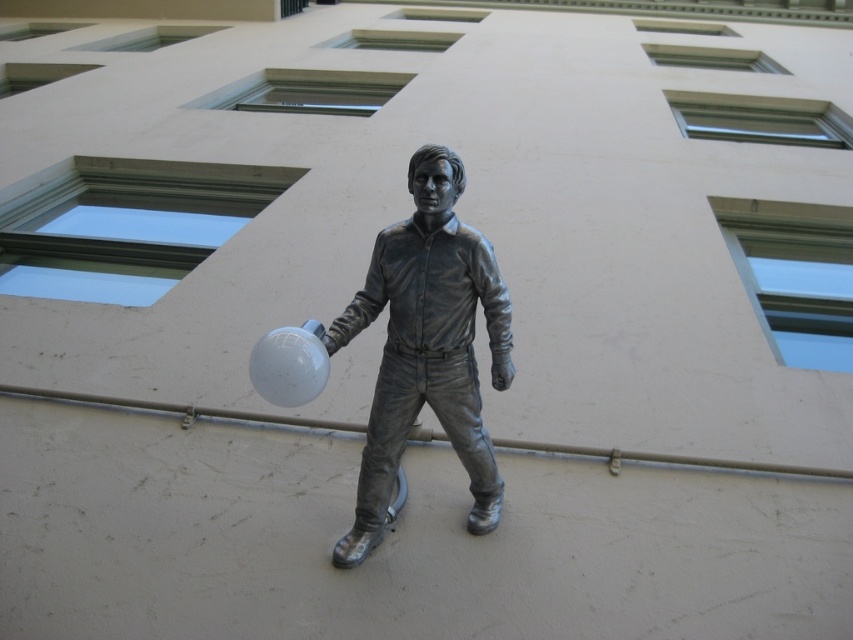
From the picture: You are a photographer trying to capture the shiny bronze figure at center and the white glossy balloon at center in a single shot. Based on their positions, which object should you adjust your camera to focus on first if you want the balloon to be in the foreground?

The shiny bronze figure at center is positioned on the right side of white glossy balloon at center. To have the balloon in the foreground, you should focus on the white glossy balloon at center first since it is closer to the camera.

You are standing in front of the statue and want to reach a point that is exactly 10 feet away from you. Can you reach the point at coordinate point (392, 440)?

The distance of point (392, 440) from viewer is 11.05 feet, which is more than 10 feet, so you cannot reach it.

You are a photographer standing at a distance from the shiny bronze figure at center. You want to take a closeup shot of the statue without moving closer. Your camera has a zoom range of 2 meters. Can you capture the entire statue in your photo?

The shiny bronze figure at center is 2.95 meters from viewer. Since the camera can zoom up to 2 meters, it cannot capture the entire statue in the photo without moving closer.